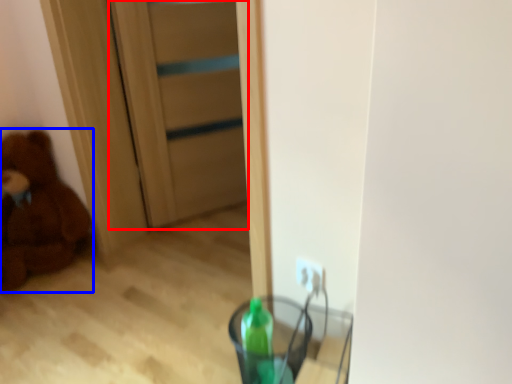
Question: Among these objects, which one is farthest to the camera, door (highlighted by a red box) or teddy bear (highlighted by a blue box)?

Choices:
 (A) door
 (B) teddy bear

Answer: (A)